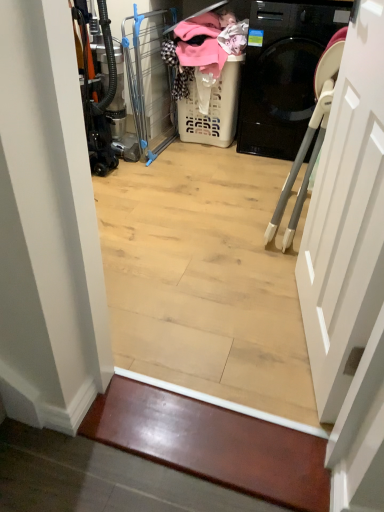
Locate an element on the screen. This screenshot has width=384, height=512. free location in front of white plastic laundry basket at center is located at coordinates (216, 160).